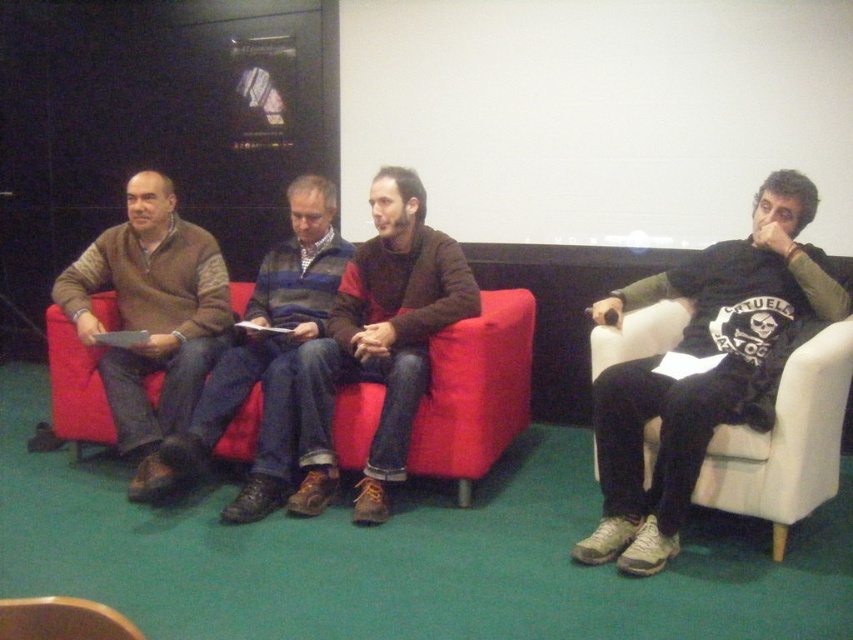
Question: Can you confirm if black cotton shirt at right is positioned to the right of brown leather armchair at lower left?

Choices:
 (A) no
 (B) yes

Answer: (B)

Question: Does brown leather jacket at center appear under matte brown sweater at left?

Choices:
 (A) yes
 (B) no

Answer: (A)

Question: Which object is the farthest from the brown leather armchair at lower left?

Choices:
 (A) red fabric couch at center
 (B) brown sweater at left
 (C) black cotton shirt at right
 (D) matte brown sweater at left

Answer: (B)

Question: Which of the following is the closest to the observer?

Choices:
 (A) (340, 464)
 (B) (62, 600)
 (C) (306, 412)
 (D) (305, 209)

Answer: (B)

Question: Considering the real-world distances, which object is farthest from the black cotton shirt at right?

Choices:
 (A) matte brown sweater at left
 (B) brown sweater at left

Answer: (B)

Question: Does black cotton shirt at right have a smaller size compared to brown leather armchair at lower left?

Choices:
 (A) no
 (B) yes

Answer: (A)